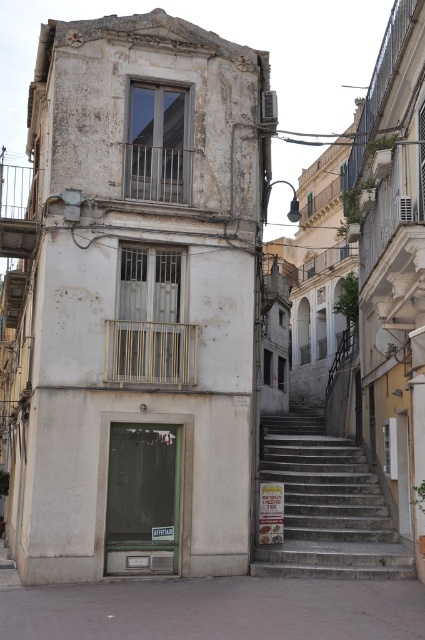
Question: Which of the following is the closest to the observer?

Choices:
 (A) concrete pavement at lower center
 (B) stone stairs at center

Answer: (A)

Question: Which point appears farthest from the camera in this image?

Choices:
 (A) (184, 614)
 (B) (370, 490)

Answer: (B)

Question: Is the position of concrete pavement at lower center less distant than that of stone stairs at center?

Choices:
 (A) no
 (B) yes

Answer: (B)

Question: Is concrete pavement at lower center wider than stone stairs at center?

Choices:
 (A) yes
 (B) no

Answer: (A)

Question: Which of the following is the farthest from the observer?

Choices:
 (A) (248, 616)
 (B) (289, 493)

Answer: (B)

Question: From the image, what is the correct spatial relationship of concrete pavement at lower center in relation to stone stairs at center?

Choices:
 (A) below
 (B) above

Answer: (A)